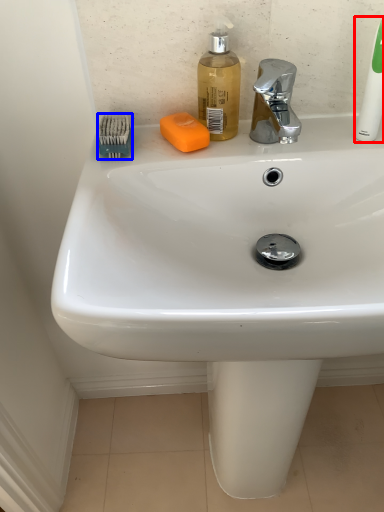
Question: Which of the following is the farthest to the observer, toothbrush (highlighted by a red box) or brush (highlighted by a blue box)?

Choices:
 (A) toothbrush
 (B) brush

Answer: (B)